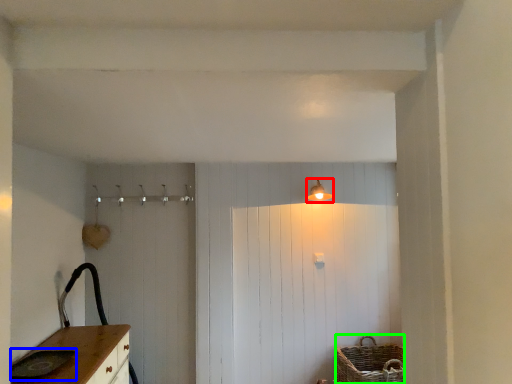
Question: Which object is the closest to the light fixture (highlighted by a red box)? Choose among these: sink (highlighted by a blue box) or basket (highlighted by a green box).

Choices:
 (A) sink
 (B) basket

Answer: (B)